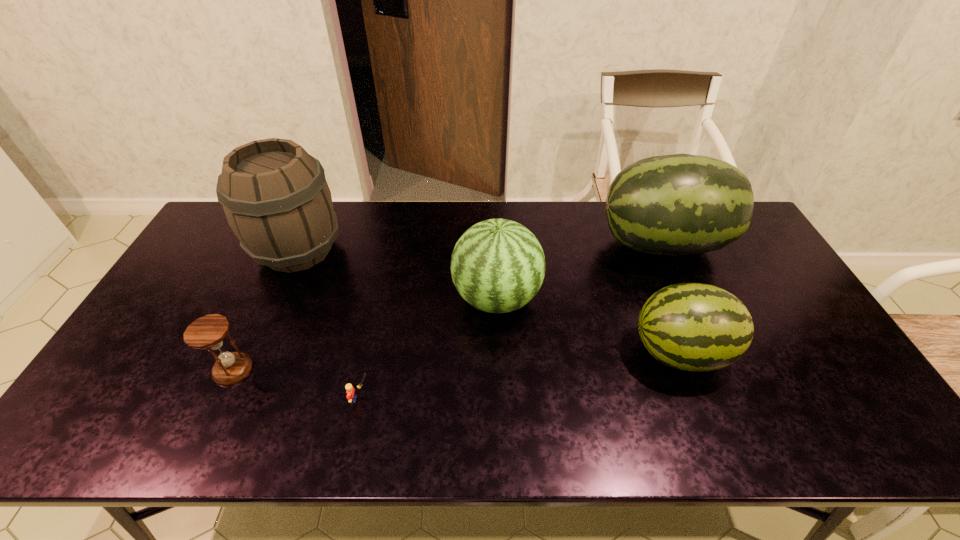
Select which watermelon appears as the second closest to the leftmost watermelon. Please provide its 2D coordinates. Your answer should be formatted as a tuple, i.e. [(x, y)], where the tuple contains the x and y coordinates of a point satisfying the conditions above.

[(696, 327)]

Choose which watermelon is the second nearest neighbor to the hourglass. Please provide its 2D coordinates. Your answer should be formatted as a tuple, i.e. [(x, y)], where the tuple contains the x and y coordinates of a point satisfying the conditions above.

[(696, 327)]

Where is `vacant region that satisfies the following two spatial constraints: 1. on the front side of the fourth object from left to right; 2. on the front-facing side of the shortest object`? vacant region that satisfies the following two spatial constraints: 1. on the front side of the fourth object from left to right; 2. on the front-facing side of the shortest object is located at coordinates (500, 399).